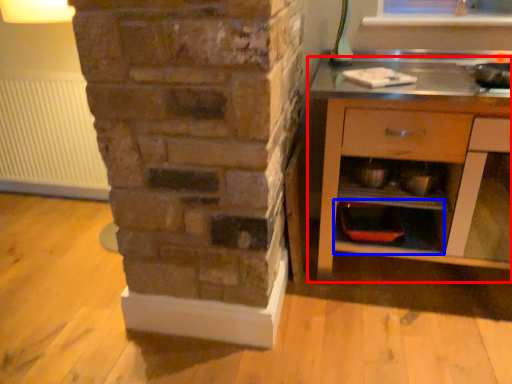
Question: Which object is closer to the camera taking this photo, chest of drawers (highlighted by a red box) or shelf (highlighted by a blue box)?

Choices:
 (A) chest of drawers
 (B) shelf

Answer: (A)